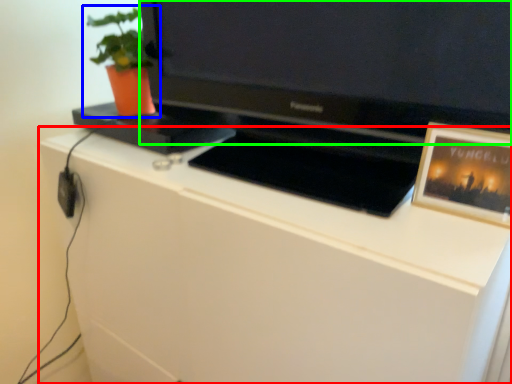
Question: Which object is the farthest from cabinetry (highlighted by a red box)? Choose among these: houseplant (highlighted by a blue box) or television (highlighted by a green box).

Choices:
 (A) houseplant
 (B) television

Answer: (A)